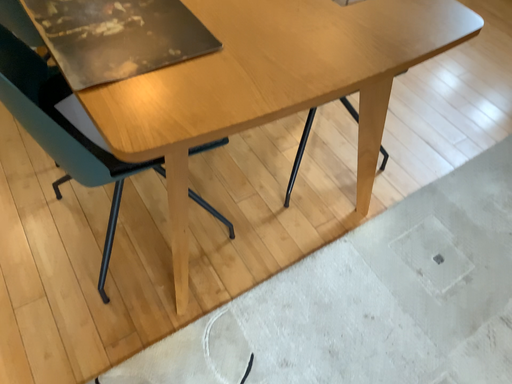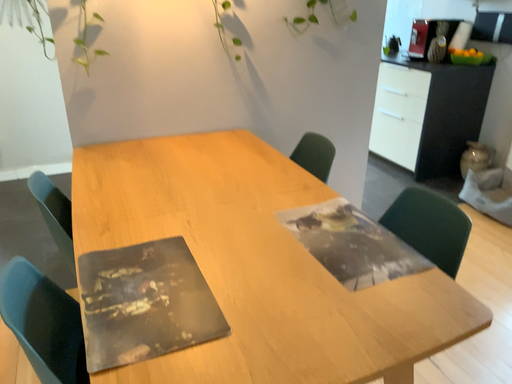
Question: Which way did the camera rotate in the video?

Choices:
 (A) rotated left
 (B) rotated right

Answer: (A)